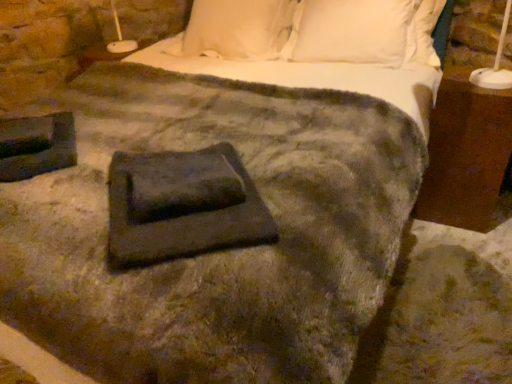
Question: Is brown wood nightstand at right in front of or behind dark gray fabric at center in the image?

Choices:
 (A) front
 (B) behind

Answer: (B)

Question: From the image's perspective, is brown wood nightstand at right located above or below dark gray fabric at center?

Choices:
 (A) below
 (B) above

Answer: (B)

Question: Based on their sizes in the image, would you say brown wood nightstand at right is bigger or smaller than dark gray fabric at center?

Choices:
 (A) big
 (B) small

Answer: (A)

Question: From the image's perspective, is dark gray fabric at center positioned above or below brown wood nightstand at right?

Choices:
 (A) above
 (B) below

Answer: (B)

Question: Considering the relative positions of dark gray fabric at center and brown wood nightstand at right in the image provided, is dark gray fabric at center to the left or to the right of brown wood nightstand at right?

Choices:
 (A) left
 (B) right

Answer: (A)

Question: Is point (140, 182) closer or farther from the camera than point (483, 210)?

Choices:
 (A) closer
 (B) farther

Answer: (A)

Question: Is dark gray fabric at center taller or shorter than brown wood nightstand at right?

Choices:
 (A) tall
 (B) short

Answer: (B)